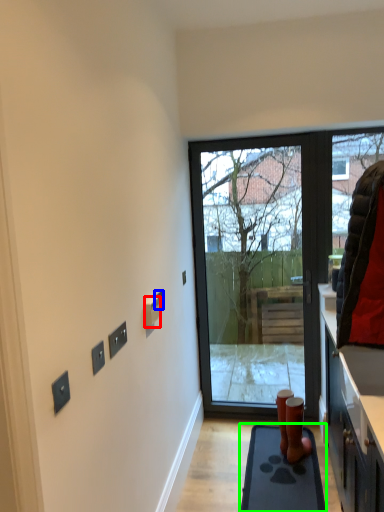
Question: Considering the real-world distances, which object is closest to electric outlet (highlighted by a red box)? electric outlet (highlighted by a blue box) or ramp (highlighted by a green box).

Choices:
 (A) electric outlet
 (B) ramp

Answer: (A)